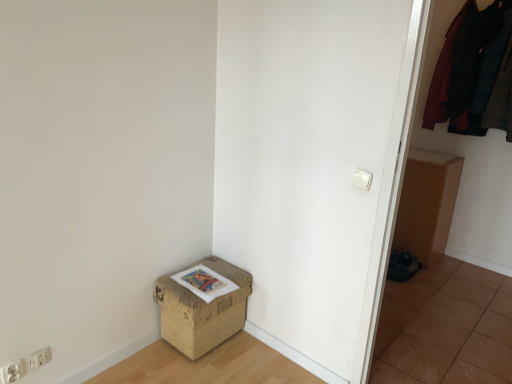
Question: From a real-world perspective, is white plastic electric outlet at lower left, the 2th electric outlet positioned from the right, under dark woolen sweater at upper right, marked as the 1th clothing in a left-to-right arrangement?

Choices:
 (A) yes
 (B) no

Answer: (A)

Question: Does white plastic electric outlet at lower left, the 2th electric outlet positioned from the back, have a larger size compared to dark woolen sweater at upper right, marked as the 1th clothing in a left-to-right arrangement?

Choices:
 (A) yes
 (B) no

Answer: (B)

Question: From a real-world perspective, is white plastic electric outlet at lower left, which appears as the 1th electric outlet when viewed from the front, positioned over dark woolen sweater at upper right, the second clothing in the right-to-left sequence, based on gravity?

Choices:
 (A) no
 (B) yes

Answer: (A)

Question: Considering the relative sizes of white plastic electric outlet at lower left, which appears as the 1th electric outlet when viewed from the front, and dark woolen sweater at upper right, the second clothing in the right-to-left sequence, in the image provided, is white plastic electric outlet at lower left, which appears as the 1th electric outlet when viewed from the front, taller than dark woolen sweater at upper right, the second clothing in the right-to-left sequence,?

Choices:
 (A) no
 (B) yes

Answer: (A)

Question: Is the depth of white plastic electric outlet at lower left, which appears as the 1th electric outlet when viewed from the front, less than that of dark woolen sweater at upper right, marked as the 1th clothing in a left-to-right arrangement?

Choices:
 (A) yes
 (B) no

Answer: (A)

Question: Considering their positions, is dark woolen sweater at upper right, which is the 1th clothing from right to left, located in front of or behind brown tile at lower right?

Choices:
 (A) behind
 (B) front

Answer: (A)

Question: Is dark woolen sweater at upper right, which is the 1th clothing from right to left, spatially inside brown tile at lower right, or outside of it?

Choices:
 (A) inside
 (B) outside

Answer: (B)

Question: Based on their positions, is dark woolen sweater at upper right, marked as the second clothing in a left-to-right arrangement, located to the left or right of brown tile at lower right?

Choices:
 (A) left
 (B) right

Answer: (B)

Question: Considering the positions of point 506,46 and point 423,369, is point 506,46 closer or farther from the camera than point 423,369?

Choices:
 (A) closer
 (B) farther

Answer: (B)

Question: From the image's perspective, is white plastic light switch at upper right above or below white plastic electric outlet at lower left, the 2th electric outlet positioned from the back?

Choices:
 (A) above
 (B) below

Answer: (A)

Question: In terms of size, does white plastic light switch at upper right appear bigger or smaller than white plastic electric outlet at lower left, the 2th electric outlet positioned from the back?

Choices:
 (A) big
 (B) small

Answer: (B)

Question: Which is correct: white plastic light switch at upper right is inside white plastic electric outlet at lower left, the 2th electric outlet positioned from the back, or outside of it?

Choices:
 (A) outside
 (B) inside

Answer: (A)

Question: Relative to white plastic electric outlet at lower left, which appears as the 1th electric outlet when viewed from the front, is white plastic light switch at upper right in front or behind?

Choices:
 (A) front
 (B) behind

Answer: (B)

Question: Considering the positions of point (456, 104) and point (474, 344), is point (456, 104) closer or farther from the camera than point (474, 344)?

Choices:
 (A) closer
 (B) farther

Answer: (B)

Question: Looking at their shapes, would you say dark woolen sweater at upper right, the second clothing in the right-to-left sequence, is wider or thinner than brown tile at lower right?

Choices:
 (A) wide
 (B) thin

Answer: (B)